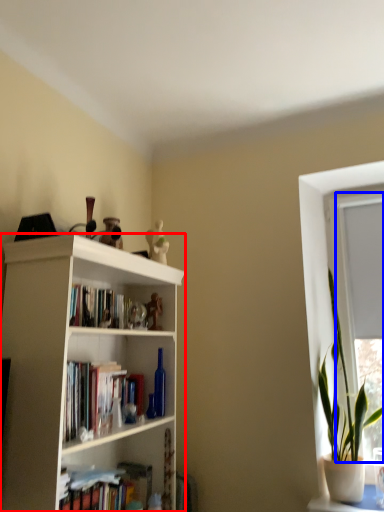
Question: Among these objects, which one is nearest to the camera, bookcase (highlighted by a red box) or window frame (highlighted by a blue box)?

Choices:
 (A) bookcase
 (B) window frame

Answer: (A)